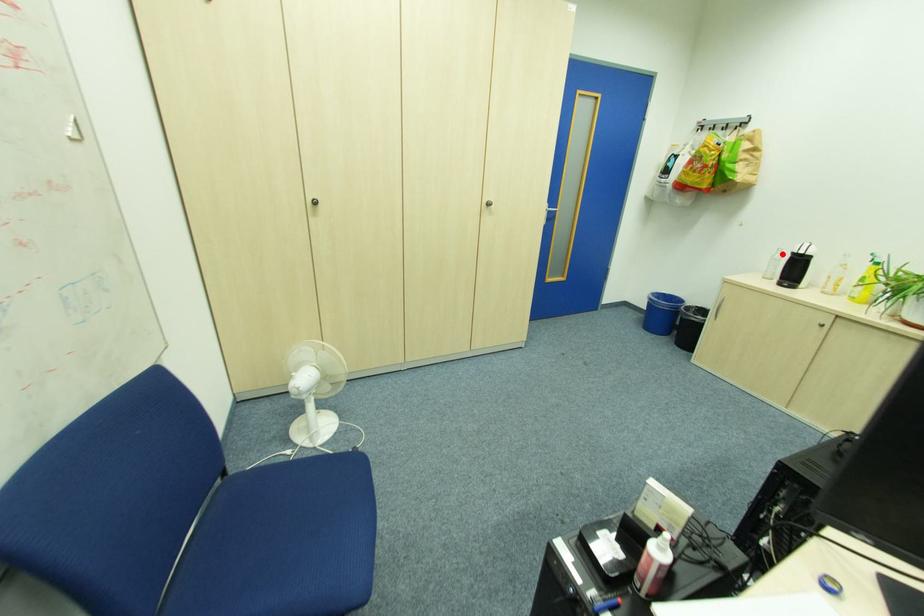
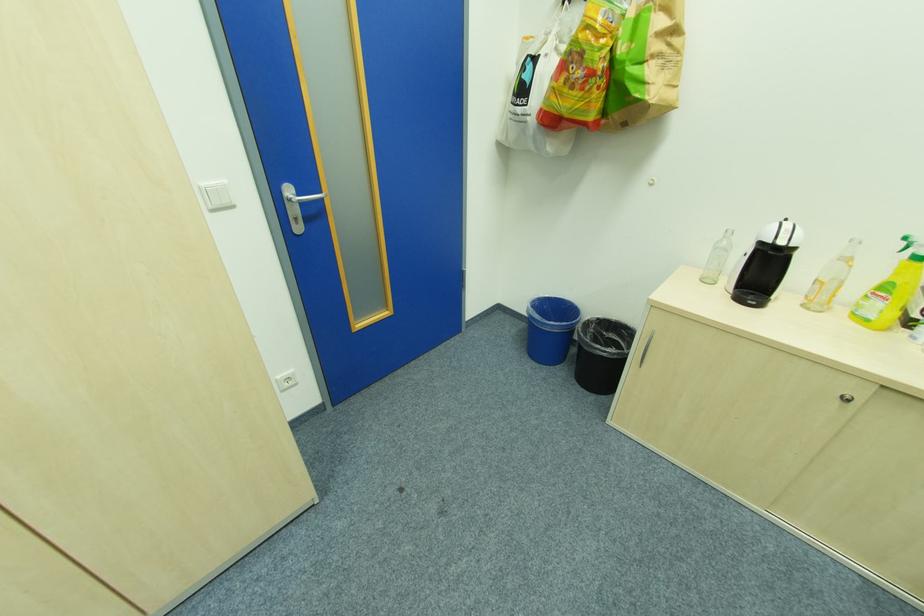
Locate, in the second image, the point that corresponds to the highlighted location in the first image.

(728, 238)